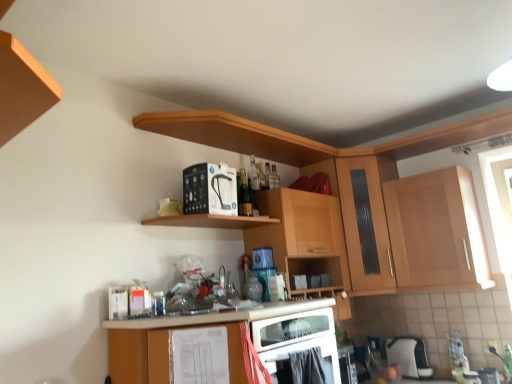
Question: From a real-world perspective, is wooden cabinet at upper right, which is counted as the first cabinetry, starting from the right, positioned above or below wooden cabinet at upper center, arranged as the second cabinetry when viewed from the left?

Choices:
 (A) above
 (B) below

Answer: (A)

Question: Relative to wooden cabinet at upper center, arranged as the 2th cabinetry when viewed from the right, is wooden cabinet at upper right, the third cabinetry positioned from the left, in front or behind?

Choices:
 (A) behind
 (B) front

Answer: (A)

Question: Estimate the real-world distances between objects in this image. Which object is closer to the metallic silver toaster at lower right, the second appliance in the top-to-bottom sequence?

Choices:
 (A) black plastic water filter at upper center, acting as the third appliance starting from the back
 (B) wooden cabinet at upper right, the third cabinetry positioned from the left
 (C) wooden at upper center, which is the first shelf from top to bottom
 (D) wooden cabinet at upper center, arranged as the 2th cabinetry when viewed from the right
 (E) matte wood cabinet at lower center, acting as the 3th cabinetry starting from the right

Answer: (B)

Question: Estimate the real-world distances between objects in this image. Which object is closer to the wooden at upper center, which is the first shelf from top to bottom?

Choices:
 (A) wooden cabinet at upper center, arranged as the 2th cabinetry when viewed from the right
 (B) white plastic toaster at lower right, the 2th appliance positioned from the left
 (C) metallic silver toaster at lower right, acting as the first appliance starting from the right
 (D) matte wood cabinet at lower center, acting as the 3th cabinetry starting from the right
 (E) wooden shelf at upper center, which is the second shelf in top-to-bottom order

Answer: (E)